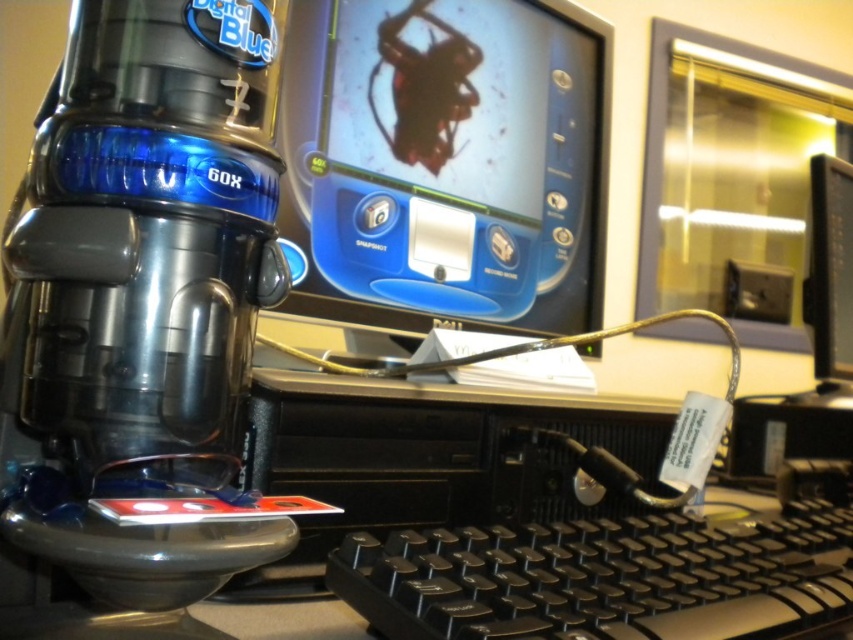
Question: Based on their relative distances, which object is nearer to the black glossy monitor at upper center?

Choices:
 (A) matte plastic monitor at center
 (B) black plastic keyboard at center

Answer: (A)

Question: Can you confirm if black plastic keyboard at center is smaller than black glossy monitor at upper center?

Choices:
 (A) yes
 (B) no

Answer: (B)

Question: Is matte plastic monitor at center bigger than black plastic keyboard at center?

Choices:
 (A) no
 (B) yes

Answer: (B)

Question: Estimate the real-world distances between objects in this image. Which object is farther from the matte plastic monitor at center?

Choices:
 (A) black plastic keyboard at center
 (B) black glossy monitor at upper center

Answer: (B)

Question: Is black plastic keyboard at center to the right of black glossy monitor at upper center from the viewer's perspective?

Choices:
 (A) no
 (B) yes

Answer: (A)

Question: Based on their relative distances, which object is nearer to the matte plastic monitor at center?

Choices:
 (A) black plastic keyboard at center
 (B) black glossy monitor at upper center

Answer: (A)